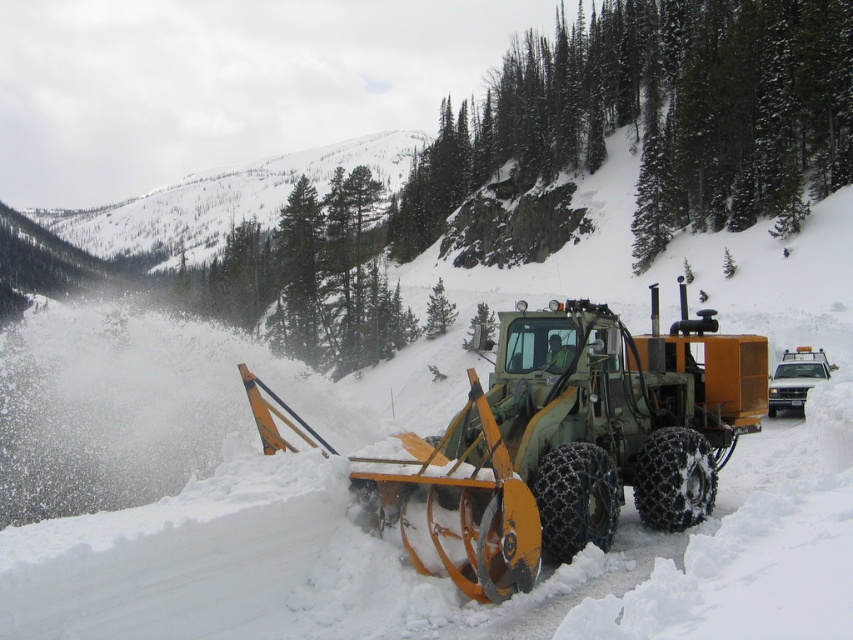
Can you confirm if green metallic snowplow at center is positioned to the right of green rubber snowplow at center?

In fact, green metallic snowplow at center is to the left of green rubber snowplow at center.

Who is higher up, green metallic snowplow at center or green rubber snowplow at center?

green metallic snowplow at center is higher up.

Is point (587, 456) closer to viewer compared to point (786, 364)?

Yes.

The width and height of the screenshot is (853, 640). In order to click on green metallic snowplow at center in this screenshot , I will do [x=572, y=442].